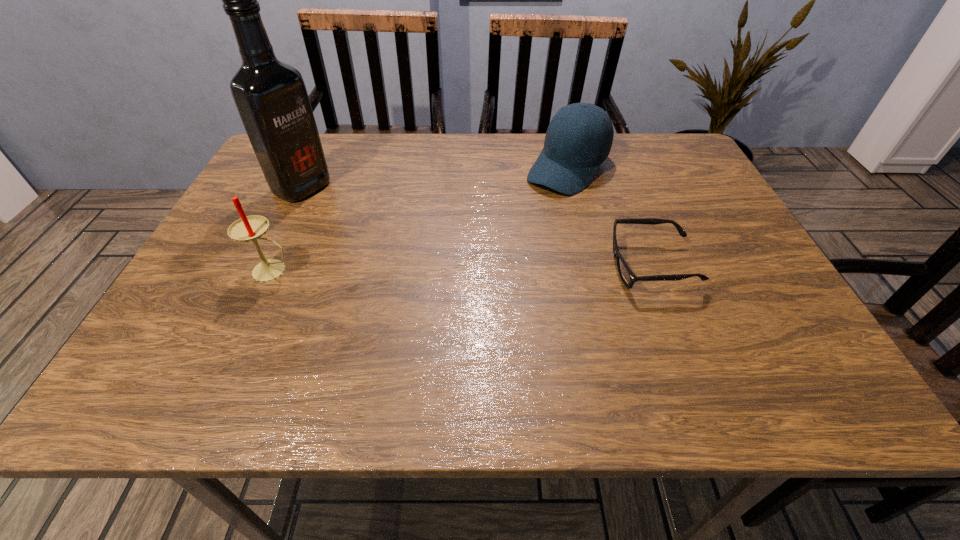
Where is `free space located 0.160m on the front-facing side of the tallest object`? free space located 0.160m on the front-facing side of the tallest object is located at coordinates (369, 219).

Identify the location of vacant position located on the front-facing side of the baseball cap. (490, 257).

Locate an element on the screen. vacant space located 0.170m on the front-facing side of the baseball cap is located at coordinates (516, 229).

At what (x,y) coordinates should I click in order to perform the action: click on vacant region located on the front-facing side of the baseball cap. Please return your answer as a coordinate pair (x, y). Looking at the image, I should click on (516, 229).

Identify the location of liquor present at the far edge. This screenshot has width=960, height=540. (271, 97).

You are a GUI agent. You are given a task and a screenshot of the screen. Output one action in this format:
    pyautogui.click(x=<x>, y=<y>)
    Task: Click on the baseball cap present at the far edge
    The width and height of the screenshot is (960, 540).
    Given the screenshot: What is the action you would take?
    pyautogui.click(x=572, y=152)

Find the location of a particular element. candle that is at the left edge is located at coordinates (247, 228).

The height and width of the screenshot is (540, 960). I want to click on liquor that is at the left edge, so click(271, 97).

Identify the location of object that is at the right edge. (627, 276).

Find the location of `object present at the far left corner`. object present at the far left corner is located at coordinates (271, 97).